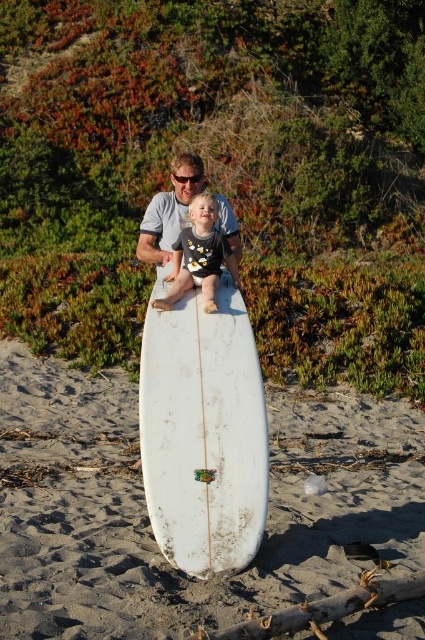
Question: Estimate the real-world distances between objects in this image. Which object is farther from the white matte surfboard at center?

Choices:
 (A) white sand at center
 (B) matte gray shirt at center
 (C) matte black shirt at center

Answer: (A)

Question: Which object is closer to the camera taking this photo?

Choices:
 (A) matte gray shirt at center
 (B) matte black shirt at center
 (C) white matte surfboard at center

Answer: (C)

Question: Which of the following is the farthest from the observer?

Choices:
 (A) matte black shirt at center
 (B) white matte surfboard at center

Answer: (A)

Question: Is matte black shirt at center closer to camera compared to matte gray shirt at center?

Choices:
 (A) no
 (B) yes

Answer: (B)

Question: Can you confirm if white sand at center is smaller than matte gray shirt at center?

Choices:
 (A) no
 (B) yes

Answer: (B)

Question: Is white matte surfboard at center closer to camera compared to matte gray shirt at center?

Choices:
 (A) yes
 (B) no

Answer: (A)